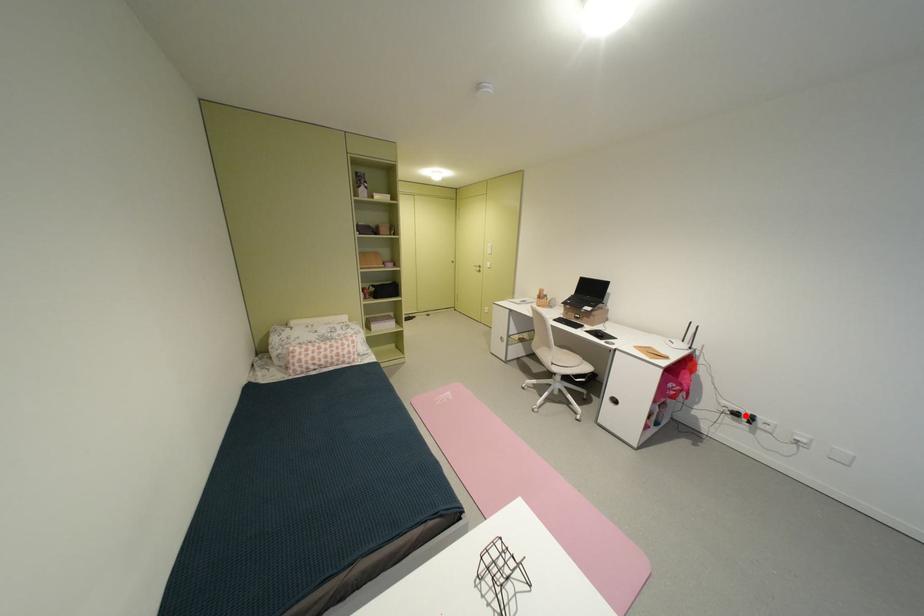
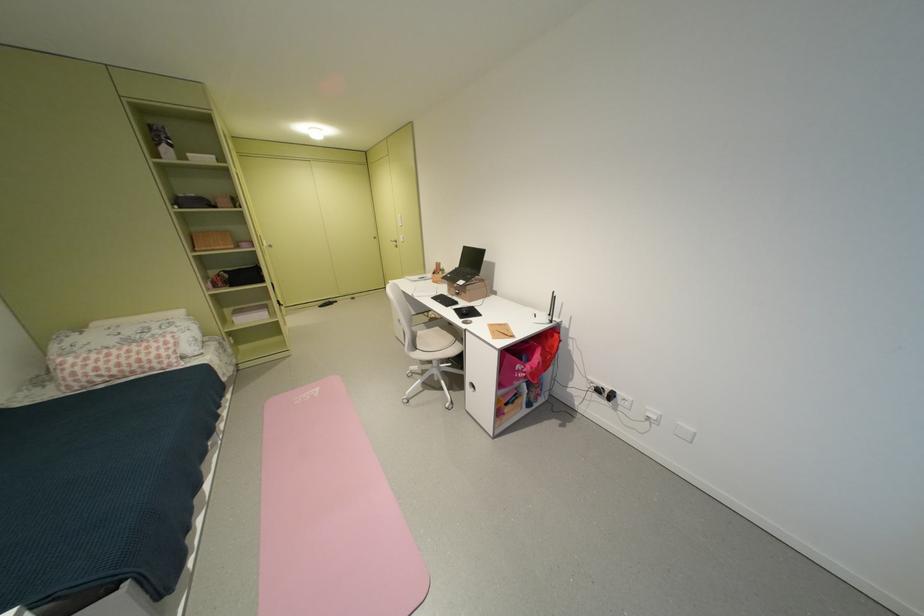
Where in the second image is the point corresponding to the highlighted location from the first image?

(609, 392)